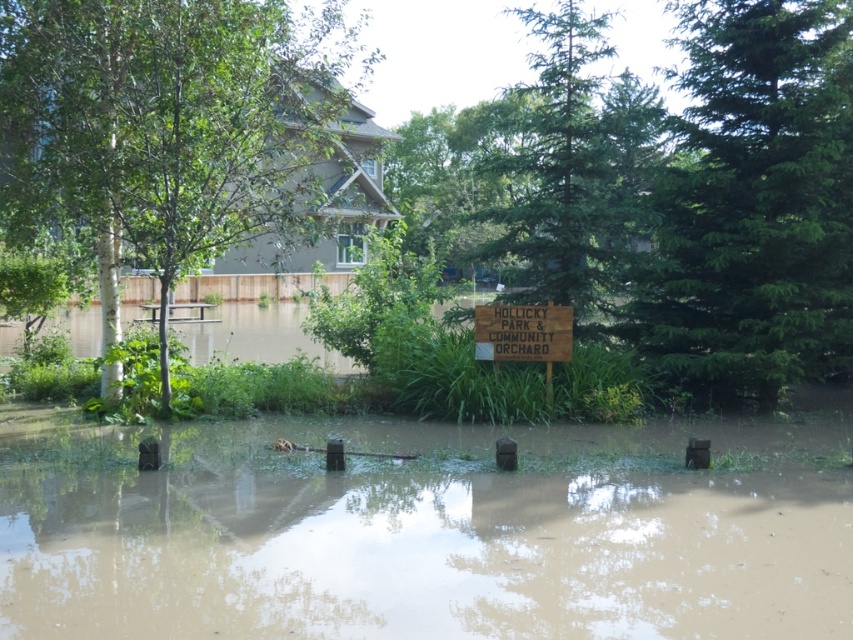
Question: Is green leafy tree at left bigger than green textured pine tree at center?

Choices:
 (A) no
 (B) yes

Answer: (B)

Question: Can you confirm if green leafy tree at left is smaller than wooden sign at center?

Choices:
 (A) yes
 (B) no

Answer: (B)

Question: Based on their relative distances, which object is farther from the wooden sign at center?

Choices:
 (A) brown muddy water at lower center
 (B) green leafy tree at left

Answer: (A)

Question: Does brown muddy water at lower center have a lesser width compared to green leafy tree at left?

Choices:
 (A) no
 (B) yes

Answer: (B)

Question: Which of the following is the farthest from the observer?

Choices:
 (A) wooden sign at center
 (B) brown muddy water at lower center

Answer: (A)

Question: Which object appears closest to the camera in this image?

Choices:
 (A) green textured pine tree at center
 (B) brown muddy water at lower center
 (C) wooden sign at center
 (D) green leafy tree at left

Answer: (B)